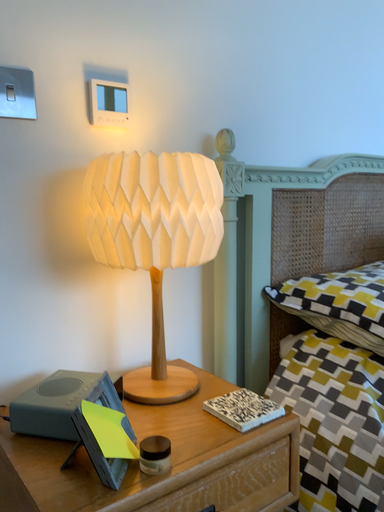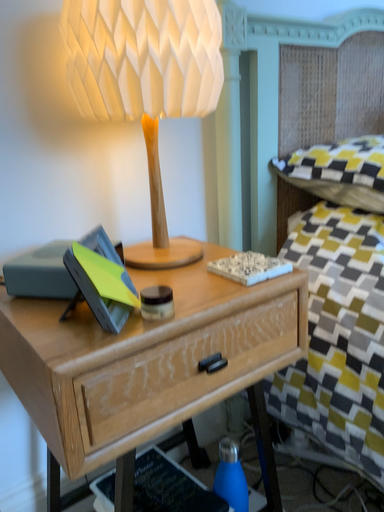
Question: How did the camera likely rotate when shooting the video?

Choices:
 (A) rotated downward
 (B) rotated upward

Answer: (A)